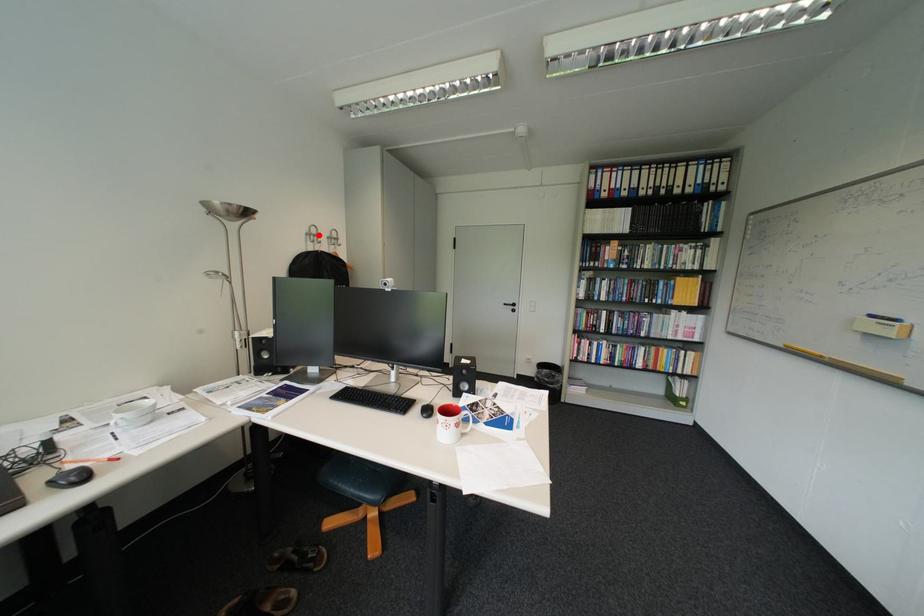
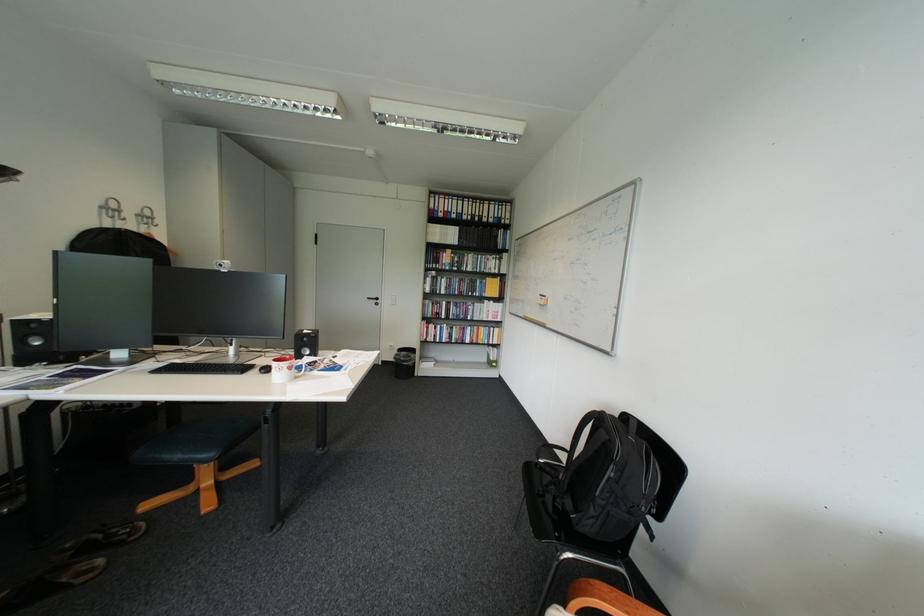
In the second image, find the point that corresponds to the highlighted location in the first image.

(114, 208)